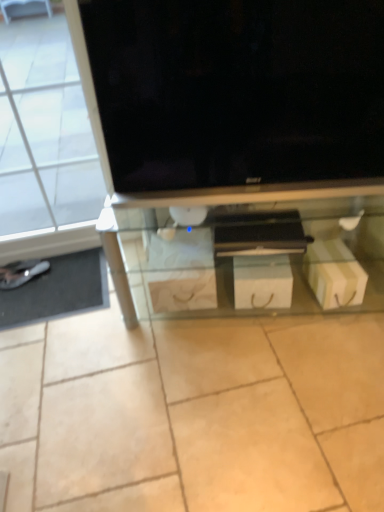
What do you see at coordinates (249, 254) in the screenshot? Image resolution: width=384 pixels, height=512 pixels. I see `transparent glass shelf at center` at bounding box center [249, 254].

The image size is (384, 512). What do you see at coordinates (334, 274) in the screenshot? I see `white cardboard box at lower right` at bounding box center [334, 274].

This screenshot has height=512, width=384. I want to click on metallic silver flat at lower left, so click(x=58, y=290).

Locate an element on the screen. The width and height of the screenshot is (384, 512). white cardboard drawer at center is located at coordinates (261, 261).

Where is `shiny silver shoe at lower left`? The height and width of the screenshot is (512, 384). shiny silver shoe at lower left is located at coordinates (21, 273).

Where is `black glossy tv at upper center`? The width and height of the screenshot is (384, 512). black glossy tv at upper center is located at coordinates (233, 95).

Where is `transparent glass shelf at center`? This screenshot has width=384, height=512. transparent glass shelf at center is located at coordinates (249, 254).

From the image's perspective, is white cardboard drawer at center located above or below metallic silver flat at lower left?

white cardboard drawer at center is situated higher than metallic silver flat at lower left in the image.

From a real-world perspective, which is physically below, white cardboard drawer at center or metallic silver flat at lower left?

metallic silver flat at lower left, from a real-world perspective.

Locate an element on the screen. flat to the left of white cardboard drawer at center is located at coordinates (58, 290).

Are white cardboard drawer at center and metallic silver flat at lower left far apart?

No, white cardboard drawer at center is in close proximity to metallic silver flat at lower left.

Between transparent glass door at left and black glossy tv at upper center, which one has larger size?

transparent glass door at left is bigger.

Considering the relative sizes of transparent glass door at left and black glossy tv at upper center in the image provided, is transparent glass door at left wider than black glossy tv at upper center?

Correct, the width of transparent glass door at left exceeds that of black glossy tv at upper center.

In the scene shown: Which object is positioned more to the left, transparent glass door at left or black glossy tv at upper center?

Positioned to the left is transparent glass door at left.

Considering the relative sizes of white cardboard box at lower right and white cardboard drawer at center in the image provided, is white cardboard box at lower right taller than white cardboard drawer at center?

In fact, white cardboard box at lower right may be shorter than white cardboard drawer at center.

Is white cardboard box at lower right next to white cardboard drawer at center?

No.

Is white cardboard box at lower right to the left of white cardboard drawer at center from the viewer's perspective?

No.

Is white cardboard box at lower right outside of white cardboard drawer at center?

white cardboard box at lower right is positioned outside white cardboard drawer at center.

Is shiny silver shoe at lower left facing away from transparent glass door at left?

That's right, shiny silver shoe at lower left is facing away from transparent glass door at left.

Which of these two, shiny silver shoe at lower left or transparent glass door at left, stands shorter?

shiny silver shoe at lower left.

Relative to transparent glass door at left, is shiny silver shoe at lower left in front or behind?

shiny silver shoe at lower left is positioned farther from the viewer than transparent glass door at left.

From a real-world perspective, between shiny silver shoe at lower left and transparent glass door at left, who is vertically lower?

shiny silver shoe at lower left is physically lower.

Which object is closer to the camera taking this photo, white cardboard box at lower right or transparent glass shelf at center?

Result: transparent glass shelf at center is more forward.

Does white cardboard box at lower right have a greater height compared to transparent glass shelf at center?

In fact, white cardboard box at lower right may be shorter than transparent glass shelf at center.

Is white cardboard box at lower right at the left side of transparent glass shelf at center?

Incorrect, white cardboard box at lower right is not on the left side of transparent glass shelf at center.

Does transparent glass shelf at center have a larger size compared to white cardboard drawer at center?

Indeed, transparent glass shelf at center has a larger size compared to white cardboard drawer at center.

Considering the sizes of transparent glass shelf at center and white cardboard drawer at center in the image, is transparent glass shelf at center taller or shorter than white cardboard drawer at center?

Clearly, transparent glass shelf at center is taller compared to white cardboard drawer at center.

The image size is (384, 512). I want to click on drawer that is below the transparent glass shelf at center (from the image's perspective), so click(x=261, y=261).

How many degrees apart are the facing directions of transparent glass shelf at center and white cardboard drawer at center?

The angular difference between transparent glass shelf at center and white cardboard drawer at center is 10.3 degrees.

Which of these two, transparent glass shelf at center or transparent glass door at left, is bigger?

transparent glass shelf at center.

Is transparent glass shelf at center taller than transparent glass door at left?

In fact, transparent glass shelf at center may be shorter than transparent glass door at left.

From the image's perspective, is transparent glass shelf at center positioned above or below transparent glass door at left?

Clearly, from the image's perspective, transparent glass shelf at center is below transparent glass door at left.

In order to click on drawer on the right side of metallic silver flat at lower left in this screenshot , I will do `click(261, 261)`.

This screenshot has width=384, height=512. Find the location of `television above the transparent glass door at left (from the image's perspective)`. television above the transparent glass door at left (from the image's perspective) is located at coordinates (233, 95).

When comparing their distances from metallic silver flat at lower left, does black glossy tv at upper center or shiny silver shoe at lower left seem closer?

shiny silver shoe at lower left.

Estimate the real-world distances between objects in this image. Which object is closer to shiny silver shoe at lower left, transparent glass shelf at center or black glossy tv at upper center?

transparent glass shelf at center.

Considering their positions, is shiny silver shoe at lower left positioned closer to metallic silver flat at lower left than black glossy tv at upper center?

Among the two, shiny silver shoe at lower left is located nearer to metallic silver flat at lower left.

Based on the photo, estimate the real-world distances between objects in this image. Which object is closer to black glossy tv at upper center, metallic silver flat at lower left or transparent glass shelf at center?

The object closer to black glossy tv at upper center is transparent glass shelf at center.

Estimate the real-world distances between objects in this image. Which object is further from shiny silver shoe at lower left, white cardboard box at lower right or transparent glass door at left?

Among the two, white cardboard box at lower right is located further to shiny silver shoe at lower left.

From the image, which object appears to be nearer to transparent glass shelf at center, white cardboard drawer at center or black glossy tv at upper center?

white cardboard drawer at center is closer to transparent glass shelf at center.

Looking at the image, which one is located closer to transparent glass door at left, metallic silver flat at lower left or black glossy tv at upper center?

Based on the image, metallic silver flat at lower left appears to be nearer to transparent glass door at left.

Looking at the image, which one is located closer to white cardboard box at lower right, transparent glass shelf at center or metallic silver flat at lower left?

transparent glass shelf at center is closer to white cardboard box at lower right.

Image resolution: width=384 pixels, height=512 pixels. In order to click on footwear between transparent glass door at left and metallic silver flat at lower left in the vertical direction in this screenshot , I will do `click(21, 273)`.

The width and height of the screenshot is (384, 512). I want to click on shelf situated between shiny silver shoe at lower left and white cardboard box at lower right from left to right, so 249,254.

The image size is (384, 512). Identify the location of shelf situated between shiny silver shoe at lower left and white cardboard drawer at center from left to right. click(249, 254).

This screenshot has width=384, height=512. In order to click on glass door situated between shiny silver shoe at lower left and white cardboard box at lower right from left to right in this screenshot , I will do `click(44, 131)`.